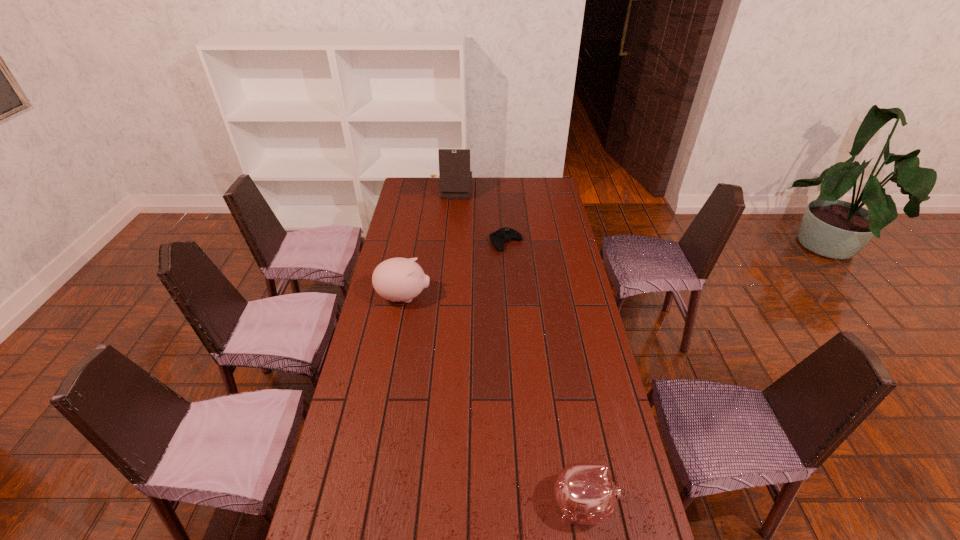
I want to click on vacant space that satisfies the following two spatial constraints: 1. at the snout of the taller piggy bank; 2. on the front facing side of the nearest object, so click(x=365, y=505).

Locate an element on the screen. This screenshot has width=960, height=540. blank area in the image that satisfies the following two spatial constraints: 1. on the front side of the phonograph record; 2. at the snout of the second tallest object is located at coordinates (441, 297).

The width and height of the screenshot is (960, 540). Find the location of `vacant space that satisfies the following two spatial constraints: 1. on the front side of the tallest object; 2. on the right side of the third nearest object`. vacant space that satisfies the following two spatial constraints: 1. on the front side of the tallest object; 2. on the right side of the third nearest object is located at coordinates (445, 242).

This screenshot has height=540, width=960. In order to click on free space that satisfies the following two spatial constraints: 1. at the snout of the third farthest object; 2. on the front facing side of the second shortest object in this screenshot , I will do coord(365,505).

This screenshot has height=540, width=960. In order to click on free location that satisfies the following two spatial constraints: 1. on the front facing side of the nearest object; 2. at the snout of the farther piggy bank in this screenshot , I will do `click(548, 297)`.

Find the location of a particular element. This screenshot has height=540, width=960. free location that satisfies the following two spatial constraints: 1. on the front side of the farthest object; 2. on the front facing side of the nearer piggy bank is located at coordinates (420, 505).

What are the coordinates of `free space in the image that satisfies the following two spatial constraints: 1. on the front facing side of the shorter piggy bank; 2. at the snout of the third farthest object` in the screenshot? It's located at (548, 297).